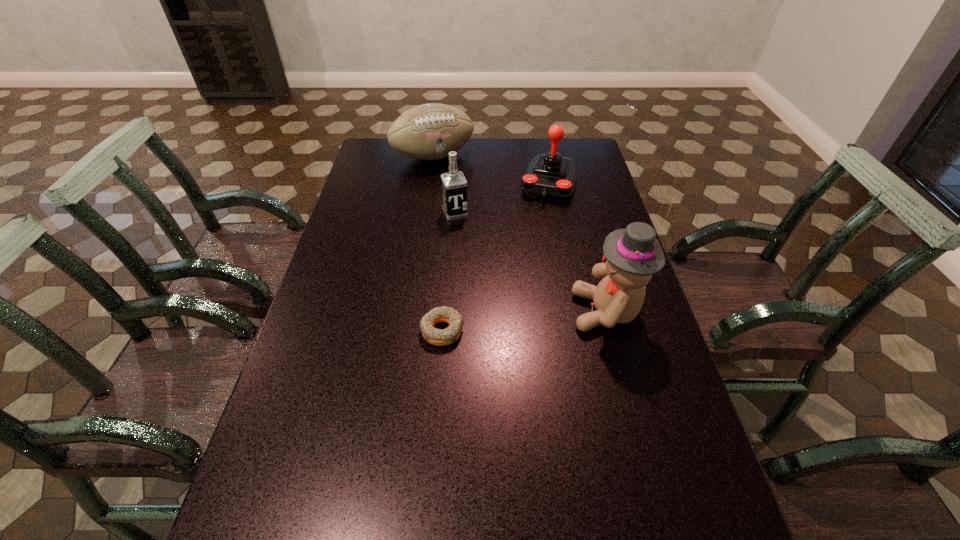
Locate an element on the screen. This screenshot has width=960, height=540. free space located on the front label of the vodka is located at coordinates (466, 235).

The height and width of the screenshot is (540, 960). What are the coordinates of `vacant space situated 0.360m on the front label of the vodka` in the screenshot? It's located at (493, 298).

I want to click on vacant space located on the base of the joystick, so click(527, 255).

The width and height of the screenshot is (960, 540). Find the location of `blank space located 0.110m on the base of the joystick`. blank space located 0.110m on the base of the joystick is located at coordinates (538, 224).

Locate an element on the screen. vacant point located 0.070m on the base of the joystick is located at coordinates (540, 217).

Where is `free space located 0.400m on the laces of the football (American)`? free space located 0.400m on the laces of the football (American) is located at coordinates (491, 232).

Locate an element on the screen. vacant space situated on the laces of the football (American) is located at coordinates (453, 178).

Where is `vacant area located 0.100m on the laces of the football (American)`? Image resolution: width=960 pixels, height=540 pixels. vacant area located 0.100m on the laces of the football (American) is located at coordinates (457, 184).

This screenshot has width=960, height=540. Find the location of `joystick that is at the far edge`. joystick that is at the far edge is located at coordinates (549, 176).

Identify the location of football (American) located at the far edge. The width and height of the screenshot is (960, 540). (427, 132).